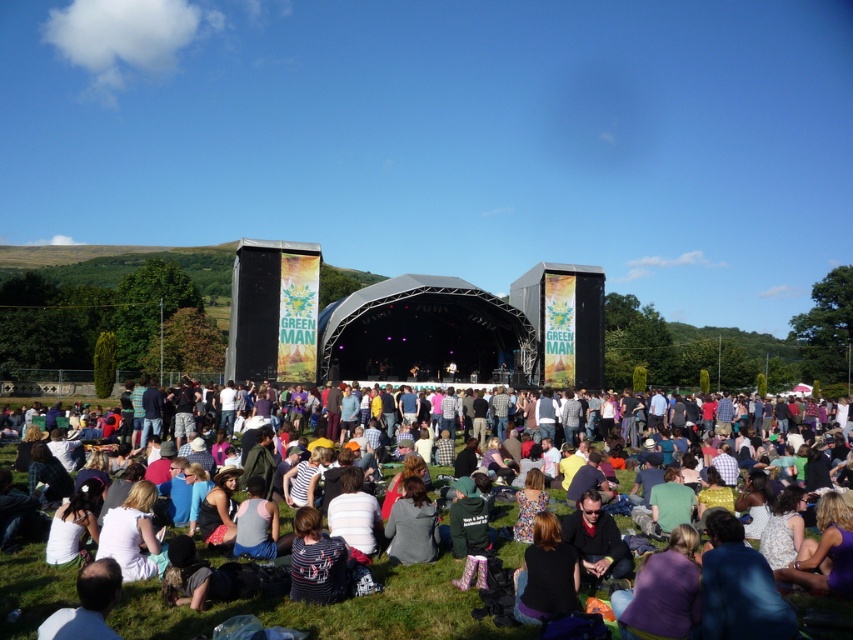
Question: Which object is the closest to the dark gray sweater at center?

Choices:
 (A) white cotton shirt at lower center
 (B) striped fabric shirt at lower center
 (C) black fabric jacket at lower center

Answer: (A)

Question: Considering the real-world distances, which object is closest to the black fabric jacket at lower center?

Choices:
 (A) dark gray sweater at center
 (B) striped fabric shirt at lower center

Answer: (A)

Question: Does white cotton shirt at lower center lie behind black fabric jacket at lower center?

Choices:
 (A) yes
 (B) no

Answer: (B)

Question: Does white cotton shirt at lower center come behind black fabric jacket at lower center?

Choices:
 (A) no
 (B) yes

Answer: (A)

Question: Considering the real-world distances, which object is closest to the striped fabric shirt at lower center?

Choices:
 (A) white cotton shirt at lower center
 (B) black fabric jacket at lower center

Answer: (A)

Question: Does white cotton shirt at lower center appear under striped fabric shirt at lower center?

Choices:
 (A) yes
 (B) no

Answer: (A)